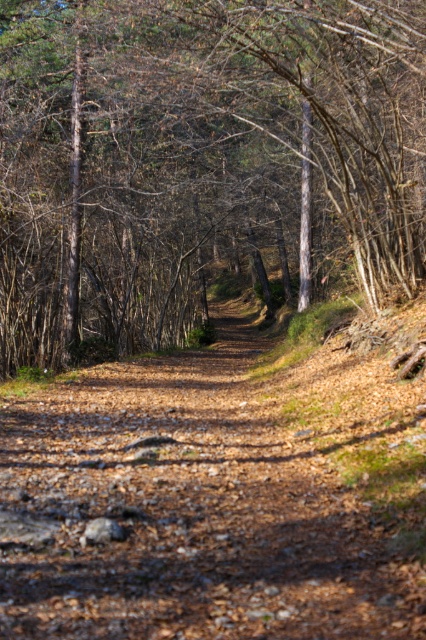
Question: Is brown bark tree at center above brown dirt track at center?

Choices:
 (A) yes
 (B) no

Answer: (A)

Question: Is brown bark tree at center closer to camera compared to brown dirt track at center?

Choices:
 (A) yes
 (B) no

Answer: (B)

Question: Among these objects, which one is farthest from the camera?

Choices:
 (A) brown dirt track at center
 (B) brown bark tree at center

Answer: (B)

Question: Can you confirm if brown bark tree at center is bigger than brown dirt track at center?

Choices:
 (A) no
 (B) yes

Answer: (B)

Question: Among these points, which one is nearest to the camera?

Choices:
 (A) (140, 198)
 (B) (91, 413)

Answer: (B)